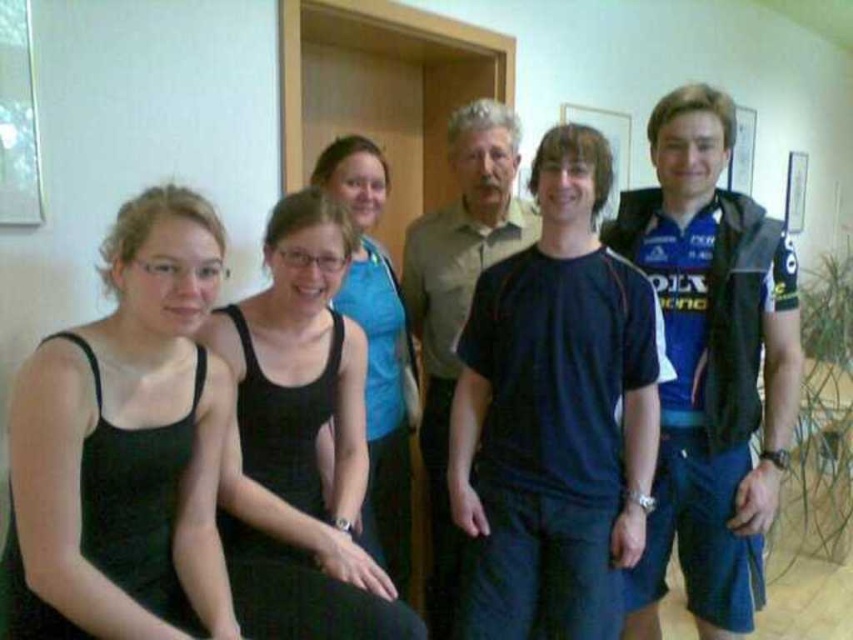
You are a photographer adjusting the lighting for a group photo. You notice two people wearing tops at the center of the image. The tops are labeled as dark blue fabric shirt at center and black matte tank top at center. Which top is closer to the camera?

The dark blue fabric shirt at center is in front of the black matte tank top at center, so the dark blue fabric shirt at center is closer to the camera.

You are a photographer trying to focus on the black matte tank top at left and the black matte tank top at center. Which one is closer to the camera?

The black matte tank top at left is positioned over the black matte tank top at center, so it is closer to the camera.

You are standing in front of the group photo and want to point out two specific points. The first point is at coordinates point (566, 387) and the second is at point (383, 282). Which of these two points is nearer to you?

Point (566, 387) is closer to the viewer than point (383, 282).